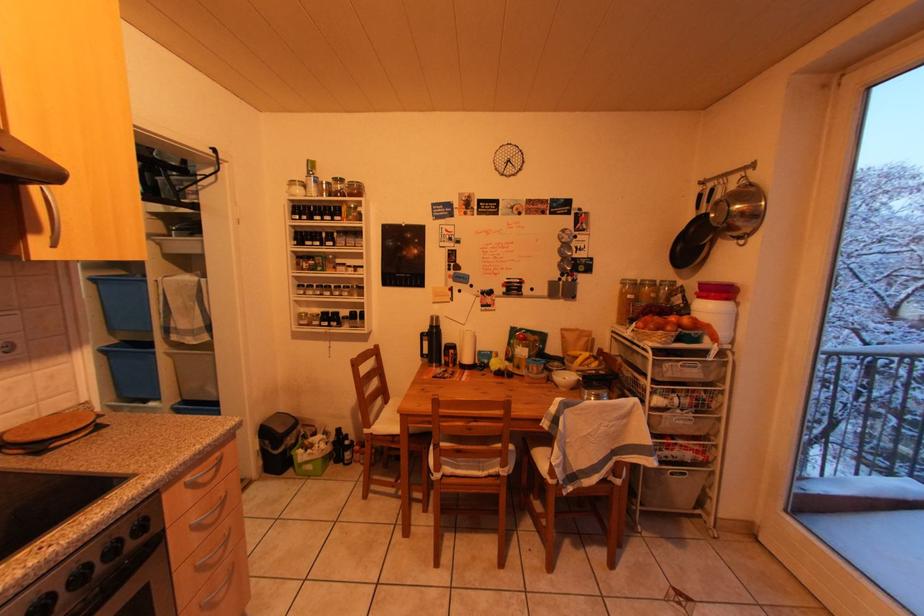
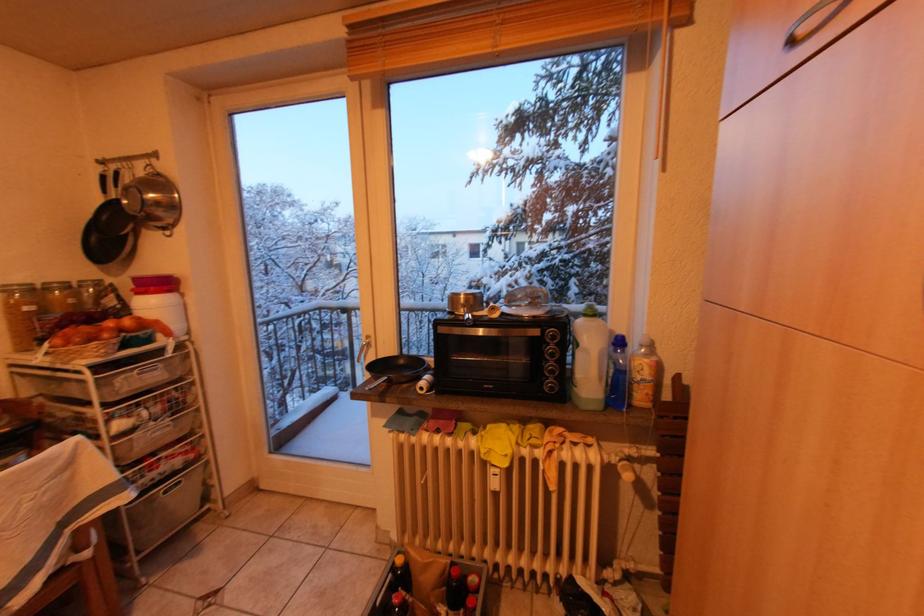
Question: The images are taken continuously from a first-person perspective. In which direction is your viewpoint rotating?

Choices:
 (A) Left
 (B) Right
 (C) Up
 (D) Down

Answer: (B)